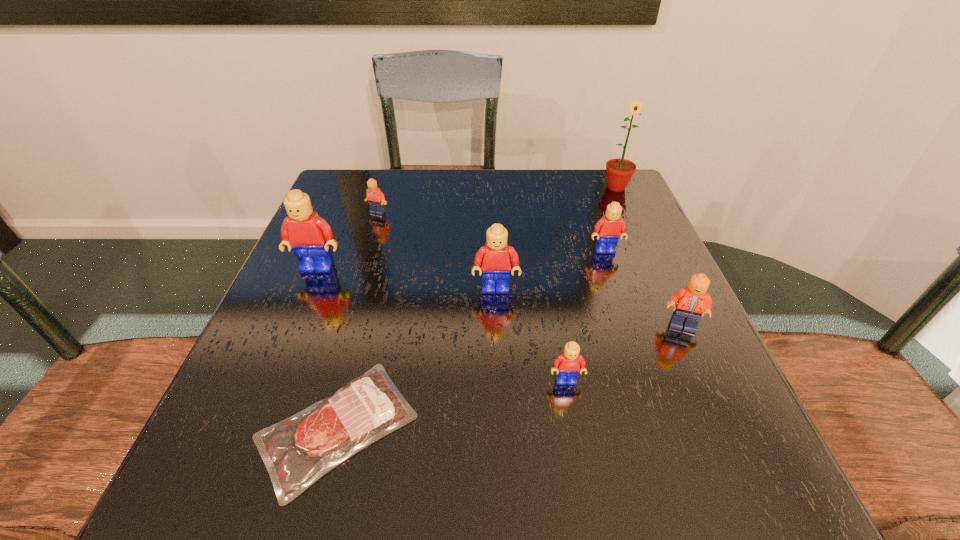
This screenshot has width=960, height=540. Find the location of `free space located 0.190m on the front-facing side of the fifth Lego from right to left`. free space located 0.190m on the front-facing side of the fifth Lego from right to left is located at coordinates (361, 267).

You are a GUI agent. You are given a task and a screenshot of the screen. Output one action in this format:
    pyautogui.click(x=<x>, y=<y>)
    Task: Click on the vacant space positioned on the front-facing side of the fourth object from right to left
    The image size is (960, 540).
    Given the screenshot: What is the action you would take?
    pyautogui.click(x=574, y=427)

Identify the location of vacant point located on the back of the steak. (371, 298).

Find the location of a particular element. The image size is (960, 540). sunflower that is at the far edge is located at coordinates (619, 170).

Where is `Lego situated at the far edge`? This screenshot has height=540, width=960. Lego situated at the far edge is located at coordinates (376, 199).

Locate an element on the screen. This screenshot has width=960, height=540. object that is at the near edge is located at coordinates (322, 436).

This screenshot has width=960, height=540. I want to click on steak situated at the left edge, so click(x=322, y=436).

The width and height of the screenshot is (960, 540). In order to click on sunflower located in the right edge section of the desktop in this screenshot , I will do `click(619, 170)`.

You are a GUI agent. You are given a task and a screenshot of the screen. Output one action in this format:
    pyautogui.click(x=<x>, y=<y>)
    Task: Click on the object that is at the far left corner
    This screenshot has width=960, height=540.
    Given the screenshot: What is the action you would take?
    pyautogui.click(x=376, y=199)

At what (x,y) coordinates should I click in order to perform the action: click on object that is positioned at the near left corner. Please return your answer as a coordinate pair (x, y). The height and width of the screenshot is (540, 960). Looking at the image, I should click on (322, 436).